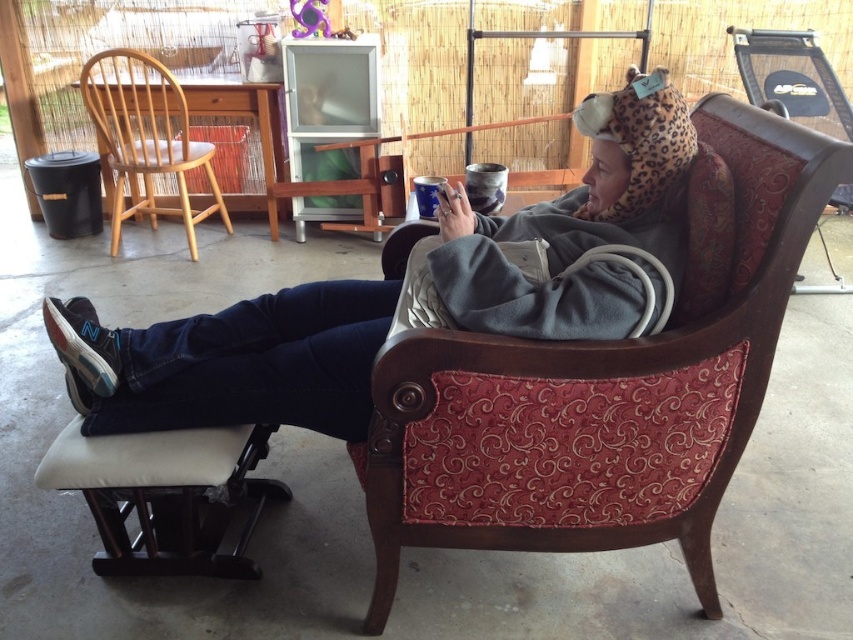
Question: Does velvet-patterned armchair at center appear on the left side of light wood chair at left?

Choices:
 (A) no
 (B) yes

Answer: (A)

Question: Which point appears farthest from the camera in this image?

Choices:
 (A) 138,122
 (B) 674,476

Answer: (A)

Question: Is velvet-patterned armchair at center positioned before light wood chair at left?

Choices:
 (A) no
 (B) yes

Answer: (B)

Question: Which of the following is the farthest from the observer?

Choices:
 (A) light wood chair at left
 (B) gray fleece blanket at upper right
 (C) velvet-patterned armchair at center

Answer: (A)

Question: Is velvet-patterned armchair at center to the left of gray fleece blanket at upper right from the viewer's perspective?

Choices:
 (A) no
 (B) yes

Answer: (A)

Question: Which object is farther from the camera taking this photo?

Choices:
 (A) velvet-patterned armchair at center
 (B) gray fleece blanket at upper right
 (C) light wood chair at left

Answer: (C)